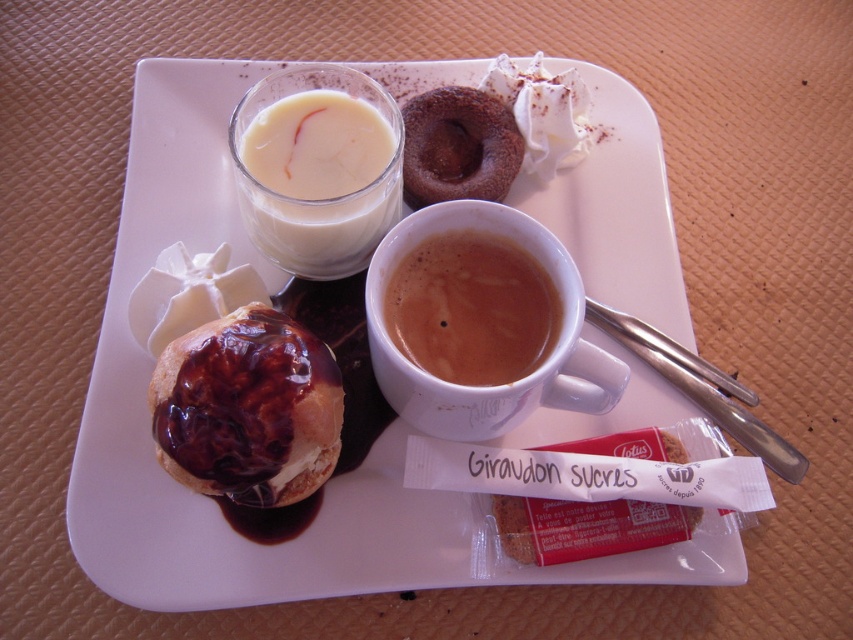
Question: Considering the relative positions of white creamy liquid at upper left and chocolate cake at upper center in the image provided, where is white creamy liquid at upper left located with respect to chocolate cake at upper center?

Choices:
 (A) below
 (B) above

Answer: (A)

Question: Can you confirm if chocolate glazed pastry at lower left is positioned below brown matte cup at center?

Choices:
 (A) no
 (B) yes

Answer: (B)

Question: Which is nearer to the chocolate glazed pastry at lower left?

Choices:
 (A) chocolate cake at upper center
 (B) matte white tray at center
 (C) white creamy liquid at upper left

Answer: (C)

Question: Which point is farther to the camera?

Choices:
 (A) (463, 124)
 (B) (460, 314)
 (C) (293, 262)
 (D) (142, 577)

Answer: (A)

Question: Which point is farther to the camera?

Choices:
 (A) tap(314, 472)
 (B) tap(194, 518)
 (C) tap(553, 291)
 (D) tap(439, 156)

Answer: (D)

Question: Can you confirm if chocolate glazed pastry at lower left is bigger than white creamy liquid at upper left?

Choices:
 (A) yes
 (B) no

Answer: (B)